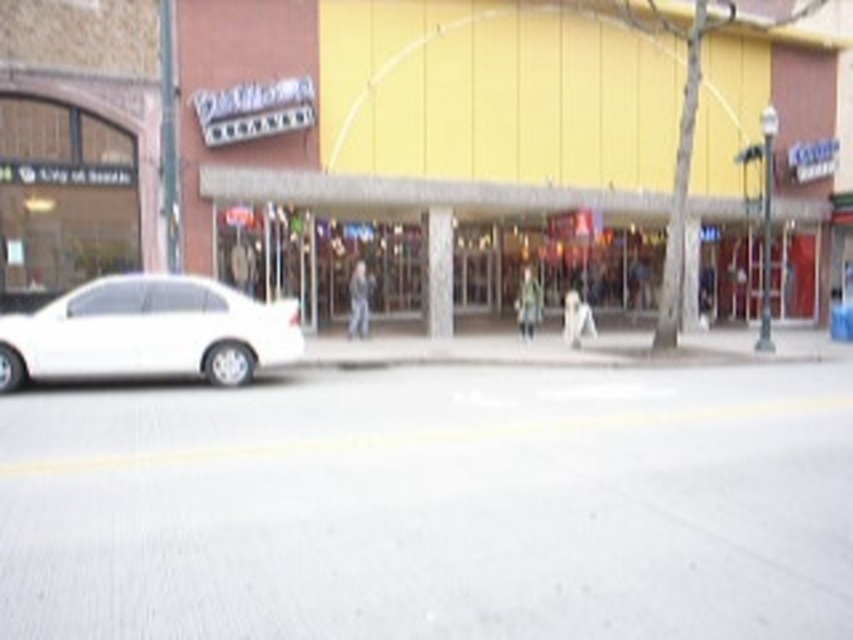
Question: Which point is farther to the camera?

Choices:
 (A) (228, 344)
 (B) (637, 51)
 (C) (239, 193)

Answer: (B)

Question: Does yellow matte mall at center appear over matte glass storefront at center?

Choices:
 (A) no
 (B) yes

Answer: (B)

Question: Is white glossy sedan at left below matte glass storefront at center?

Choices:
 (A) no
 (B) yes

Answer: (B)

Question: Which point appears farthest from the camera in this image?

Choices:
 (A) (x=161, y=356)
 (B) (x=349, y=202)

Answer: (B)

Question: Does yellow matte mall at center have a larger size compared to white glossy sedan at left?

Choices:
 (A) no
 (B) yes

Answer: (B)

Question: Which point is farther from the camera taking this photo?

Choices:
 (A) (805, 220)
 (B) (398, 266)

Answer: (B)